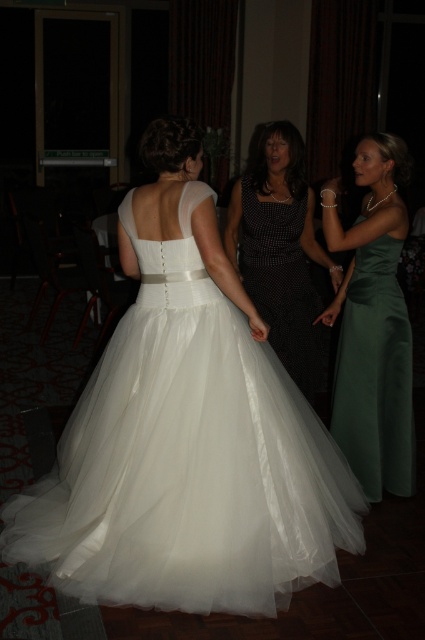
You are a photographer at a wedding reception and need to capture a group photo of the satin green dress at right and the black dotted dress at center. Based on their positions, which dress should you focus on first if you want to include both in the frame without moving the camera?

The satin green dress at right is positioned on the right side of the black dotted dress at center, so you should focus on the black dotted dress at center first to ensure both are in the frame.

You are a photographer at a wedding reception. You need to capture a photo of the satin green dress at right and the black dotted dress at center. Which dress should you focus on first if you want to highlight the size difference between them?

The satin green dress at right is bigger than the black dotted dress at center, so you should focus on the satin green dress at right first to emphasize its larger size.